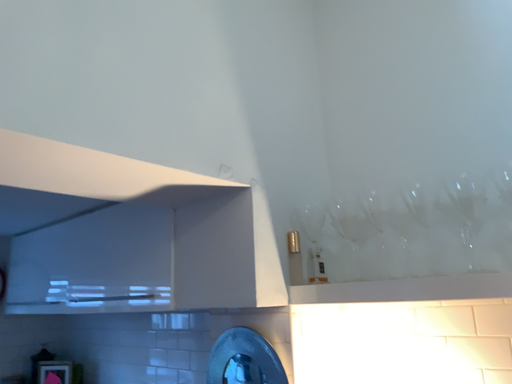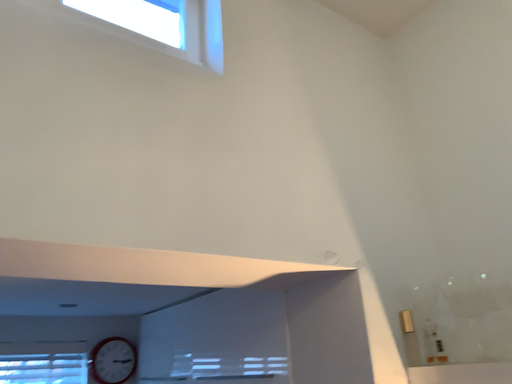
Question: How did the camera likely rotate when shooting the video?

Choices:
 (A) rotated downward
 (B) rotated upward

Answer: (B)